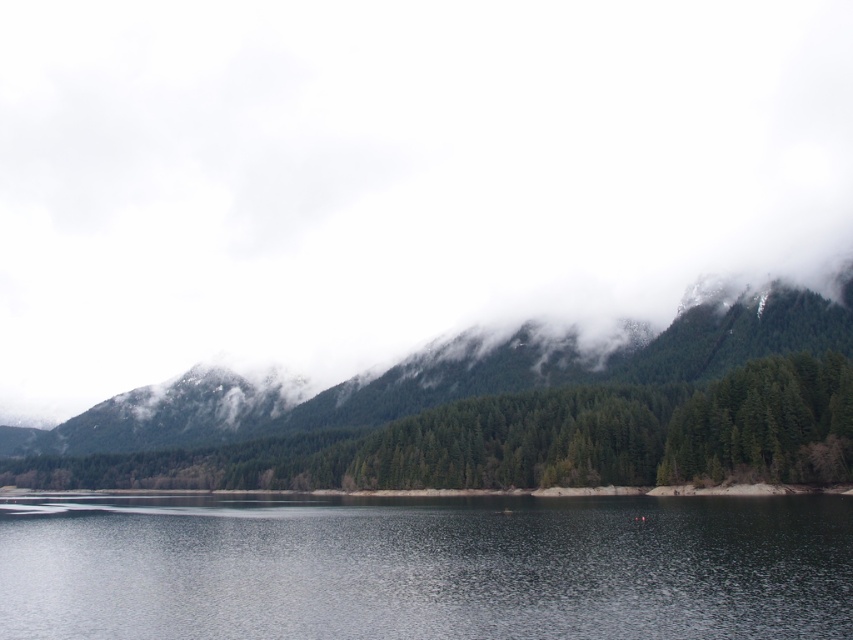
You are an airplane pilot flying over the serene natural landscape. You notice the white fluffy cloud at upper center and the green matte forest at center. Which object is wider from your perspective?

The white fluffy cloud at upper center might be wider than the green matte forest at center, so the cloud is likely wider from your perspective.

You are standing at the point closer to the viewer in the image. Which point are you at, point (498, 525) or point (520, 378)?

You are at point (498, 525) because it is closer to the viewer than point (520, 378).

You are planning to cross the smooth dark water at center using a small wooden raft. There is also a green matte forest at center nearby. Considering their sizes, which one do you think would be easier to traverse quickly?

The smooth dark water at center has a lesser width compared to the green matte forest at center, so it would be easier to traverse quickly.